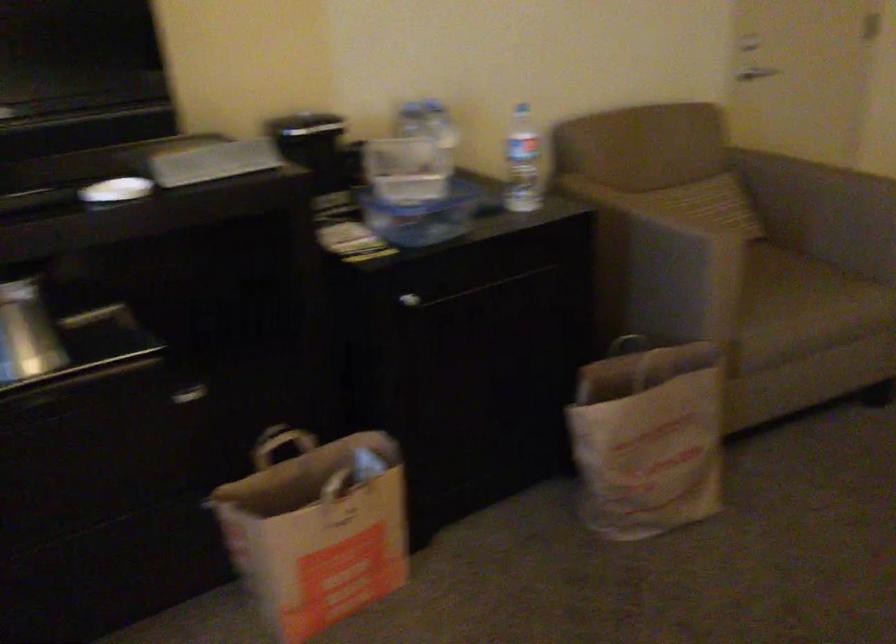
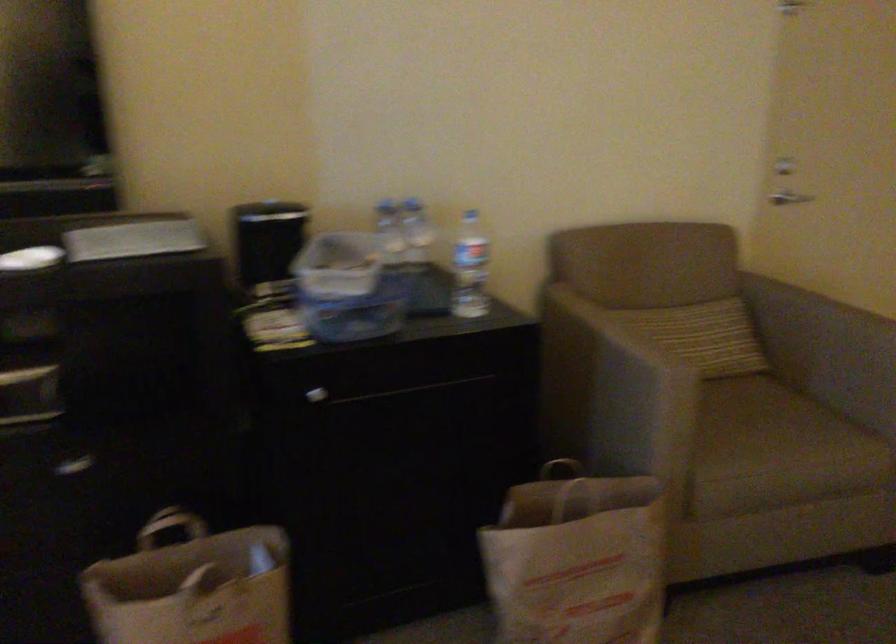
In the second image, find the point that corresponds to pixel 302 466 in the first image.

(192, 554)